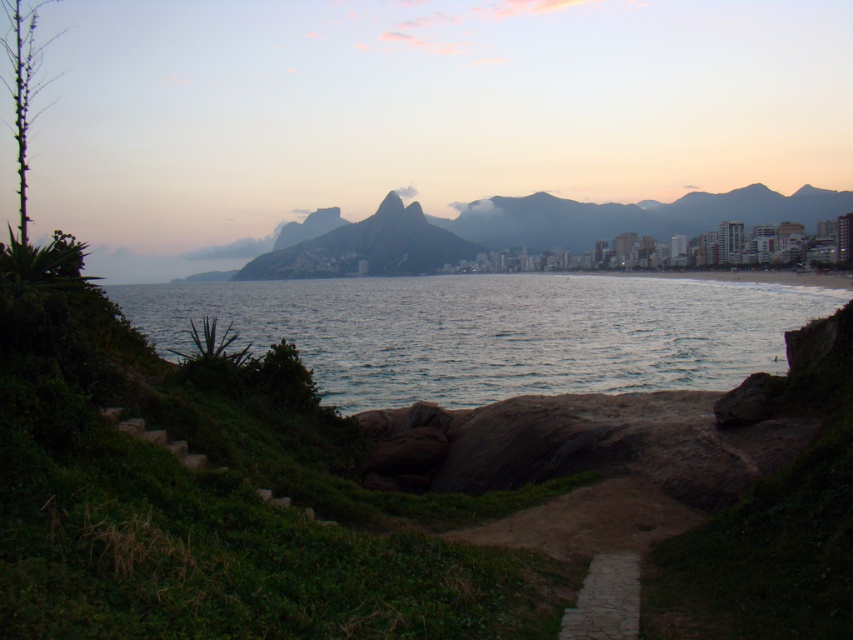
Question: Is blue water at center thinner than rugged granite mountain at center?

Choices:
 (A) no
 (B) yes

Answer: (A)

Question: Which point is closer to the camera?

Choices:
 (A) (358, 256)
 (B) (614, 556)

Answer: (B)

Question: Which object is farther from the camera taking this photo?

Choices:
 (A) blue water at center
 (B) stone paved path at lower center
 (C) rugged granite mountain at center

Answer: (C)

Question: Can you confirm if rugged granite mountain at center is bigger than stone paved path at lower center?

Choices:
 (A) no
 (B) yes

Answer: (B)

Question: Does blue water at center appear on the right side of stone paved path at lower center?

Choices:
 (A) no
 (B) yes

Answer: (A)

Question: Which of the following is the farthest from the observer?

Choices:
 (A) (596, 609)
 (B) (584, 369)

Answer: (B)